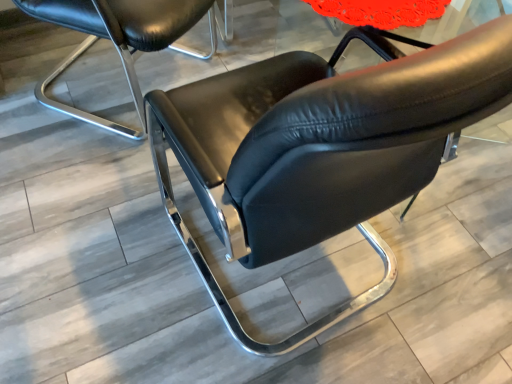
The width and height of the screenshot is (512, 384). Describe the element at coordinates (321, 147) in the screenshot. I see `black leather chair at center, the 2th chair positioned from the left` at that location.

Find the location of `black leather chair at center, placed as the first chair when sorted from right to left`. black leather chair at center, placed as the first chair when sorted from right to left is located at coordinates (321, 147).

Image resolution: width=512 pixels, height=384 pixels. Describe the element at coordinates (121, 38) in the screenshot. I see `matte black chair at center, which is the 2th chair from right to left` at that location.

This screenshot has height=384, width=512. Find the location of `matte black chair at center, the 1th chair viewed from the left`. matte black chair at center, the 1th chair viewed from the left is located at coordinates (121, 38).

Locate an element on the screen. This screenshot has width=512, height=384. black leather chair at center, the 2th chair positioned from the left is located at coordinates (321, 147).

Looking at this image, can you confirm if black leather chair at center, placed as the first chair when sorted from right to left, is positioned to the left of matte black chair at center, which is the 2th chair from right to left?

Incorrect, black leather chair at center, placed as the first chair when sorted from right to left, is not on the left side of matte black chair at center, which is the 2th chair from right to left.

Is black leather chair at center, the 2th chair positioned from the left, positioned before matte black chair at center, which is the 2th chair from right to left?

Yes, black leather chair at center, the 2th chair positioned from the left, is in front of matte black chair at center, which is the 2th chair from right to left.

Between point (248, 201) and point (110, 121), which one is positioned behind?

The point (110, 121) is behind.

From the image's perspective, which one is positioned higher, black leather chair at center, the 2th chair positioned from the left, or matte black chair at center, which is the 2th chair from right to left?

matte black chair at center, which is the 2th chair from right to left.

From a real-world perspective, is black leather chair at center, the 2th chair positioned from the left, positioned above or below matte black chair at center, the 1th chair viewed from the left?

black leather chair at center, the 2th chair positioned from the left, is above matte black chair at center, the 1th chair viewed from the left.

Which object is thinner, black leather chair at center, the 2th chair positioned from the left, or matte black chair at center, which is the 2th chair from right to left?

Thinner between the two is matte black chair at center, which is the 2th chair from right to left.

Does black leather chair at center, placed as the first chair when sorted from right to left, have a greater height compared to matte black chair at center, which is the 2th chair from right to left?

Correct, black leather chair at center, placed as the first chair when sorted from right to left, is much taller as matte black chair at center, which is the 2th chair from right to left.

Considering the sizes of objects black leather chair at center, placed as the first chair when sorted from right to left, and matte black chair at center, the 1th chair viewed from the left, in the image provided, who is smaller, black leather chair at center, placed as the first chair when sorted from right to left, or matte black chair at center, the 1th chair viewed from the left,?

Smaller between the two is matte black chair at center, the 1th chair viewed from the left.

Would you say matte black chair at center, which is the 2th chair from right to left, is part of black leather chair at center, the 2th chair positioned from the left,'s contents?

No, black leather chair at center, the 2th chair positioned from the left, does not contain matte black chair at center, which is the 2th chair from right to left.

Are black leather chair at center, the 2th chair positioned from the left, and matte black chair at center, the 1th chair viewed from the left, beside each other?

They are not placed beside each other.

Is black leather chair at center, the 2th chair positioned from the left, facing towards matte black chair at center, which is the 2th chair from right to left?

No.

How many degrees apart are the facing directions of black leather chair at center, the 2th chair positioned from the left, and matte black chair at center, which is the 2th chair from right to left?

37.7 degrees separate the facing orientations of black leather chair at center, the 2th chair positioned from the left, and matte black chair at center, which is the 2th chair from right to left.

Where is `chair below the black leather chair at center, the 2th chair positioned from the left (from a real-world perspective)`? The width and height of the screenshot is (512, 384). chair below the black leather chair at center, the 2th chair positioned from the left (from a real-world perspective) is located at coordinates pyautogui.click(x=121, y=38).

Which object is positioned more to the right, matte black chair at center, which is the 2th chair from right to left, or black leather chair at center, placed as the first chair when sorted from right to left?

Positioned to the right is black leather chair at center, placed as the first chair when sorted from right to left.

Who is more distant, matte black chair at center, the 1th chair viewed from the left, or black leather chair at center, placed as the first chair when sorted from right to left?

Positioned behind is matte black chair at center, the 1th chair viewed from the left.

Which is closer to the camera, (184, 19) or (279, 241)?

The point (279, 241) is in front.

From the image's perspective, does matte black chair at center, which is the 2th chair from right to left, appear higher than black leather chair at center, the 2th chair positioned from the left?

Indeed, from the image's perspective, matte black chair at center, which is the 2th chair from right to left, is shown above black leather chair at center, the 2th chair positioned from the left.

From a real-world perspective, between matte black chair at center, which is the 2th chair from right to left, and black leather chair at center, placed as the first chair when sorted from right to left, who is vertically higher?

In real-world perspective, black leather chair at center, placed as the first chair when sorted from right to left, is above.

Considering the sizes of objects matte black chair at center, which is the 2th chair from right to left, and black leather chair at center, placed as the first chair when sorted from right to left, in the image provided, who is thinner, matte black chair at center, which is the 2th chair from right to left, or black leather chair at center, placed as the first chair when sorted from right to left,?

matte black chair at center, which is the 2th chair from right to left, is thinner.

Does matte black chair at center, which is the 2th chair from right to left, have a greater height compared to black leather chair at center, placed as the first chair when sorted from right to left?

Incorrect, the height of matte black chair at center, which is the 2th chair from right to left, is not larger of that of black leather chair at center, placed as the first chair when sorted from right to left.

Considering the relative sizes of matte black chair at center, the 1th chair viewed from the left, and black leather chair at center, placed as the first chair when sorted from right to left, in the image provided, is matte black chair at center, the 1th chair viewed from the left, smaller than black leather chair at center, placed as the first chair when sorted from right to left,?

Yes.

Is matte black chair at center, the 1th chair viewed from the left, not inside black leather chair at center, placed as the first chair when sorted from right to left?

Yes, matte black chair at center, the 1th chair viewed from the left, is located beyond the bounds of black leather chair at center, placed as the first chair when sorted from right to left.

Are matte black chair at center, the 1th chair viewed from the left, and black leather chair at center, the 2th chair positioned from the left, far apart?

No, matte black chair at center, the 1th chair viewed from the left, is not far away from black leather chair at center, the 2th chair positioned from the left.

Is matte black chair at center, the 1th chair viewed from the left, oriented away from black leather chair at center, placed as the first chair when sorted from right to left?

No, matte black chair at center, the 1th chair viewed from the left,'s orientation is not away from black leather chair at center, placed as the first chair when sorted from right to left.

Find the location of a particular element. chair below the matte black chair at center, which is the 2th chair from right to left (from the image's perspective) is located at coordinates (321, 147).

I want to click on chair located below the matte black chair at center, which is the 2th chair from right to left (from the image's perspective), so click(x=321, y=147).

The height and width of the screenshot is (384, 512). What are the coordinates of `chair on the left of black leather chair at center, placed as the first chair when sorted from right to left` in the screenshot? It's located at (121, 38).